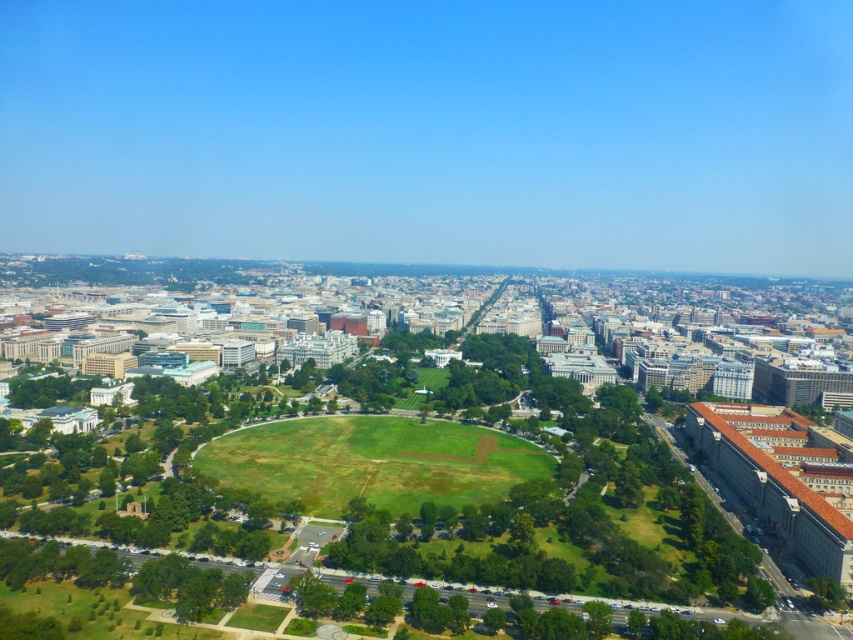
Which is more to the right, green leafy tree at center or green grassy field at center?

Positioned to the right is green leafy tree at center.

In the scene shown: Can you confirm if green leafy tree at center is positioned to the right of green grassy field at center?

Correct, you'll find green leafy tree at center to the right of green grassy field at center.

The height and width of the screenshot is (640, 853). What do you see at coordinates (498, 506) in the screenshot?
I see `green leafy tree at center` at bounding box center [498, 506].

Identify the location of green leafy tree at center. (498, 506).